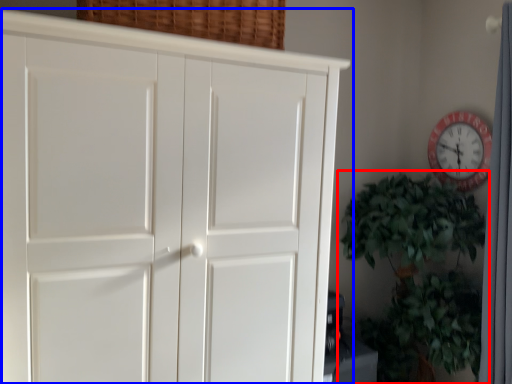
Question: Which object is closer to the camera taking this photo, houseplant (highlighted by a red box) or cupboard (highlighted by a blue box)?

Choices:
 (A) houseplant
 (B) cupboard

Answer: (B)